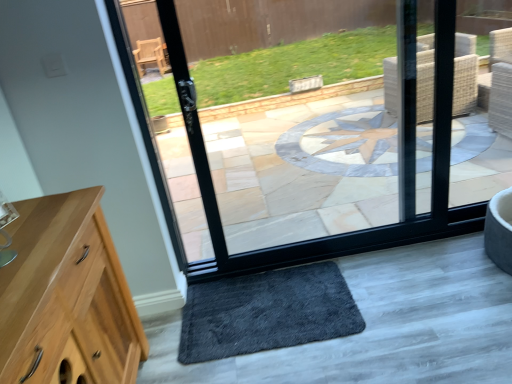
Where is `dark gray shaggy mat at center`? This screenshot has width=512, height=384. dark gray shaggy mat at center is located at coordinates (267, 312).

Describe the element at coordinates (267, 312) in the screenshot. I see `dark gray shaggy mat at center` at that location.

This screenshot has height=384, width=512. Identify the location of dark gray shaggy mat at center. (267, 312).